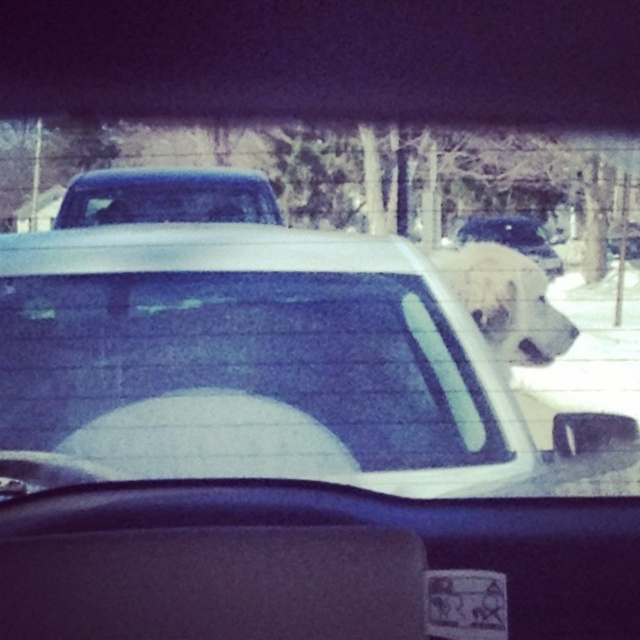
You are a passenger in a car and want to look at the white plastic license plate at center. Which side of the clear glass window at upper center should you look towards to see it?

To see the white plastic license plate at center, you should look towards the right side of the clear glass window at upper center because the license plate is to the right of the window.

You are a passenger in the vehicle and want to look at the clear glass window at upper center and the transparent glass window at center. Which one is above the other?

The clear glass window at upper center is above the transparent glass window at center because the transparent glass window at center is positioned under it.